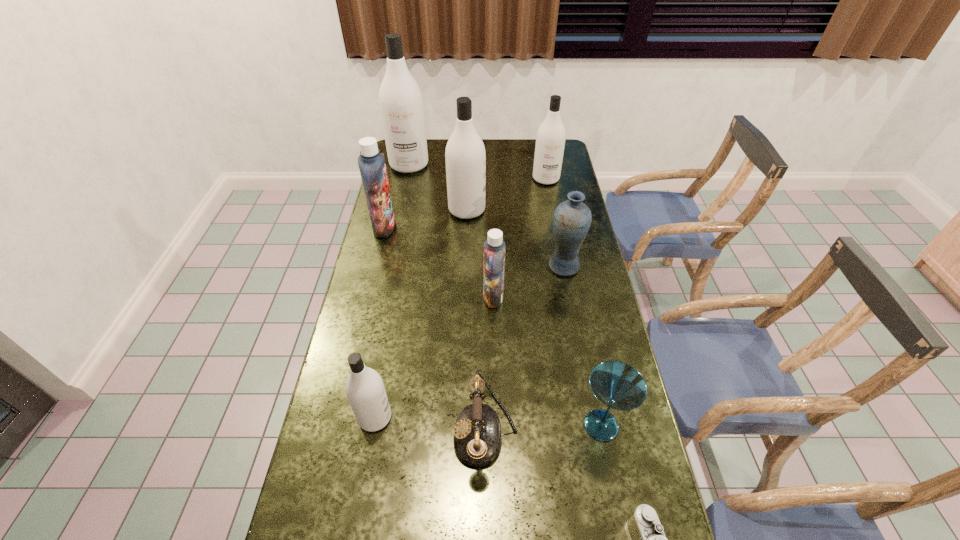
Identify the location of the right blue shampoo. This screenshot has width=960, height=540. (494, 247).

The height and width of the screenshot is (540, 960). I want to click on the sixth farthest object, so click(494, 247).

Identify the location of the nearest white shampoo. (365, 390).

Where is `the nearest shampoo`? This screenshot has width=960, height=540. the nearest shampoo is located at coordinates (365, 390).

The width and height of the screenshot is (960, 540). In order to click on the third shortest object in this screenshot , I will do `click(617, 385)`.

Where is `black telephone`? The height and width of the screenshot is (540, 960). black telephone is located at coordinates (477, 437).

You are a GUI agent. You are given a task and a screenshot of the screen. Output one action in this format:
    pyautogui.click(x=<x>, y=<y>)
    Task: Click on the telephone
    The width and height of the screenshot is (960, 540).
    Given the screenshot: What is the action you would take?
    pyautogui.click(x=477, y=437)

You are a GUI agent. You are given a task and a screenshot of the screen. Output one action in this format:
    pyautogui.click(x=<x>, y=<y>)
    Task: Click on the vacant position located on the front-facing side of the biggest white shampoo
    This screenshot has width=960, height=540.
    Given the screenshot: What is the action you would take?
    pyautogui.click(x=405, y=183)

Locate an element on the screen. The image size is (960, 540). free space located 0.320m on the front-facing side of the fifth shortest shampoo is located at coordinates (565, 210).

Identify the location of free space located on the front label of the bigger blue shampoo. (451, 227).